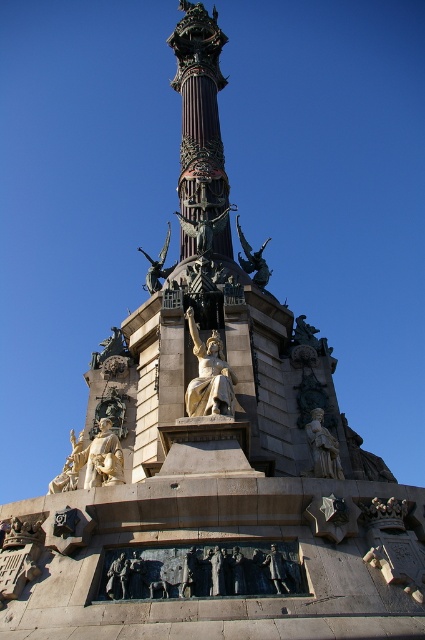
Question: Is gold polished statue at center wider than bronze statue at center?

Choices:
 (A) yes
 (B) no

Answer: (B)

Question: Does polished bronze statue at center have a larger size compared to bronze statue at center?

Choices:
 (A) no
 (B) yes

Answer: (A)

Question: Which of the following is the closest to the observer?

Choices:
 (A) (155, 284)
 (B) (329, 460)
 (C) (229, 378)

Answer: (C)

Question: Which point appears farthest from the camera in this image?

Choices:
 (A) (167, 221)
 (B) (329, 461)

Answer: (A)

Question: Does polished bronze statue at center have a greater width compared to bronze statue at center?

Choices:
 (A) no
 (B) yes

Answer: (A)

Question: Which object is positioned closest to the polished bronze statue at center?

Choices:
 (A) gold polished statue at center
 (B) bronze statue at center

Answer: (A)